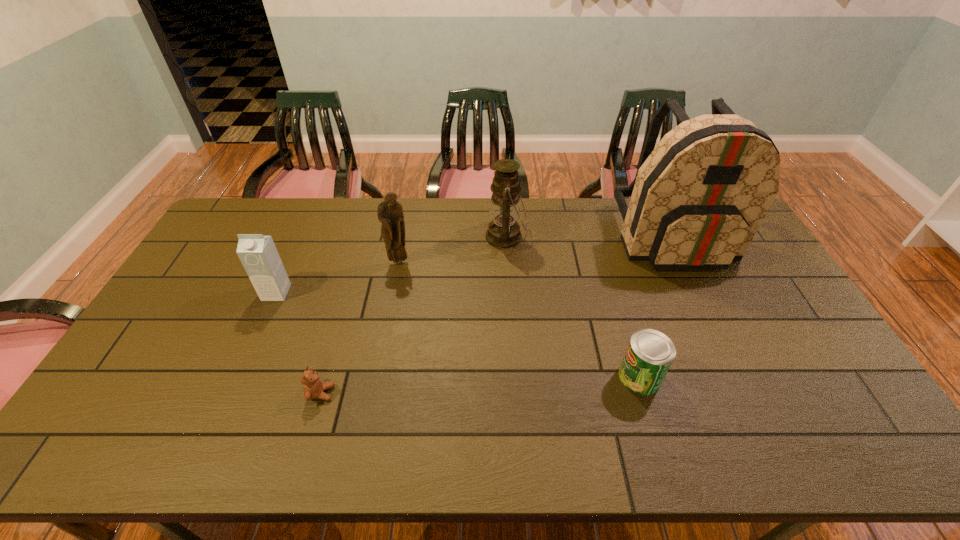
This screenshot has width=960, height=540. I want to click on blank region between the tallest object and the third object from left to right, so click(536, 249).

This screenshot has height=540, width=960. What are the coordinates of `free space that is in between the rightmost object and the third object from right to left` in the screenshot? It's located at (589, 237).

Find the location of `free area in between the carton and the tallest object`. free area in between the carton and the tallest object is located at coordinates (474, 265).

The height and width of the screenshot is (540, 960). What are the coordinates of `free spot between the can and the fifth object from right to left` in the screenshot? It's located at (480, 385).

Point out which object is positioned as the third nearest to the oil lamp. Please provide its 2D coordinates. Your answer should be formatted as a tuple, i.e. [(x, y)], where the tuple contains the x and y coordinates of a point satisfying the conditions above.

[(650, 353)]

Where is `object identified as the second closest to the carton`? The width and height of the screenshot is (960, 540). object identified as the second closest to the carton is located at coordinates (313, 387).

Locate an element on the screen. The width and height of the screenshot is (960, 540). vacant area that satisfies the following two spatial constraints: 1. on the front-facing side of the figurine; 2. on the right side of the second object from right to left is located at coordinates (377, 377).

This screenshot has height=540, width=960. Identify the location of blank space that satisfies the following two spatial constraints: 1. on the front-facing side of the third object from left to right; 2. on the right side of the fifth object from left to right. (377, 377).

This screenshot has width=960, height=540. What are the coordinates of `vacant area that satisfies the following two spatial constraints: 1. on the front side of the second shortest object; 2. on the right side of the oil lamp` in the screenshot? It's located at (515, 377).

You are a GUI agent. You are given a task and a screenshot of the screen. Output one action in this format:
    pyautogui.click(x=<x>, y=<y>)
    Task: Click on the vacant position in the image that satisfies the following two spatial constraints: 1. on the front face of the tallest object; 2. on the face of the fifth object from right to left
    The width and height of the screenshot is (960, 540).
    Given the screenshot: What is the action you would take?
    pos(748,393)